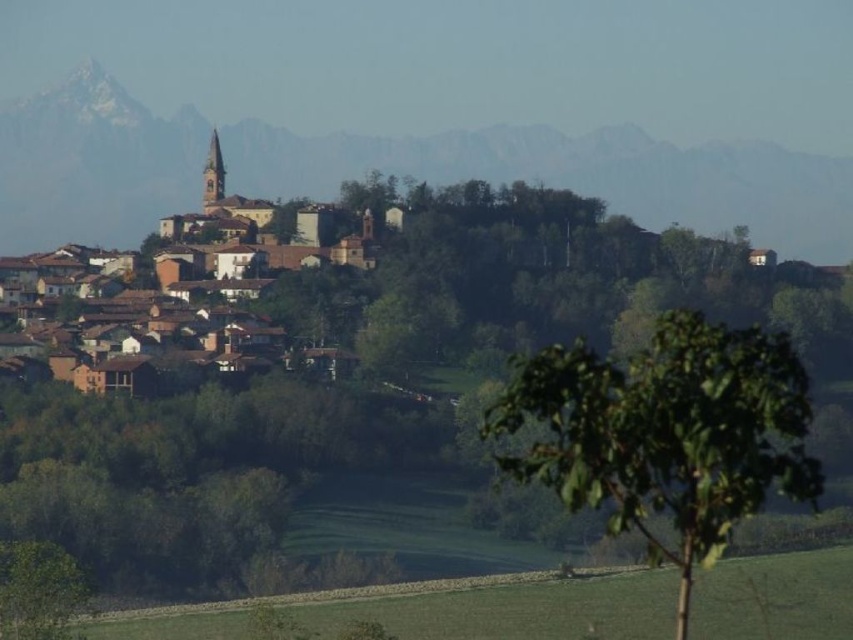
Does snowy rocky mountain at upper center have a greater height compared to green leafy tree at lower left?

Yes, snowy rocky mountain at upper center is taller than green leafy tree at lower left.

Who is shorter, snowy rocky mountain at upper center or green leafy tree at lower left?

green leafy tree at lower left

Measure the distance between point (62, 125) and camera.

672.90 meters

Where is `snowy rocky mountain at upper center`? snowy rocky mountain at upper center is located at coordinates (578, 176).

Does point (585, 451) lie behind point (48, 595)?

No, it is in front of (48, 595).

Can you confirm if green leafy tree at center is positioned to the left of green leafy tree at lower left?

No, green leafy tree at center is not to the left of green leafy tree at lower left.

The width and height of the screenshot is (853, 640). Identify the location of green leafy tree at center. (666, 433).

Who is positioned more to the right, snowy rocky mountain at upper center or brown clay houses at center?

snowy rocky mountain at upper center is more to the right.

Measure the distance between point (241, 164) and camera.

The distance of point (241, 164) from camera is 659.76 meters.

Between point (708, 150) and point (368, 218), which one is positioned in front?

Point (368, 218)

Image resolution: width=853 pixels, height=640 pixels. I want to click on snowy rocky mountain at upper center, so click(x=578, y=176).